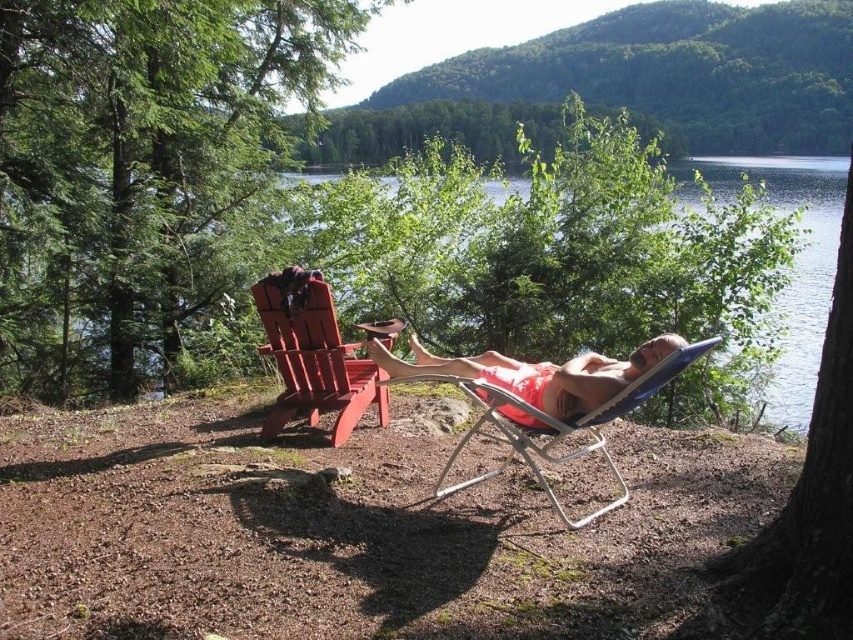
Question: Does green leafy tree at right have a larger size compared to blue fabric beach chair at center?

Choices:
 (A) yes
 (B) no

Answer: (B)

Question: Is green matte tree at left to the left of smooth wood beach chair at left from the viewer's perspective?

Choices:
 (A) no
 (B) yes

Answer: (B)

Question: Which point is closer to the camera?

Choices:
 (A) (509, 112)
 (B) (373, 368)
 (C) (837, 625)

Answer: (C)

Question: Does green matte tree at left have a greater width compared to clear blue water at center?

Choices:
 (A) no
 (B) yes

Answer: (A)

Question: Which of the following is the farthest from the observer?

Choices:
 (A) orange fabric recliner at center
 (B) green leafy tree at right

Answer: (A)

Question: Which object appears farthest from the camera in this image?

Choices:
 (A) green leafy tree at right
 (B) green leafy tree at upper center
 (C) blue fabric beach chair at center
 (D) orange fabric recliner at center

Answer: (B)